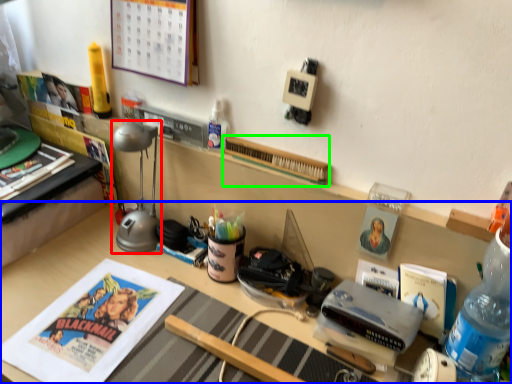
Question: Which object is positioned closest to table lamp (highlighted by a red box)? Select from desk (highlighted by a blue box) and book (highlighted by a green box).

Choices:
 (A) desk
 (B) book

Answer: (A)